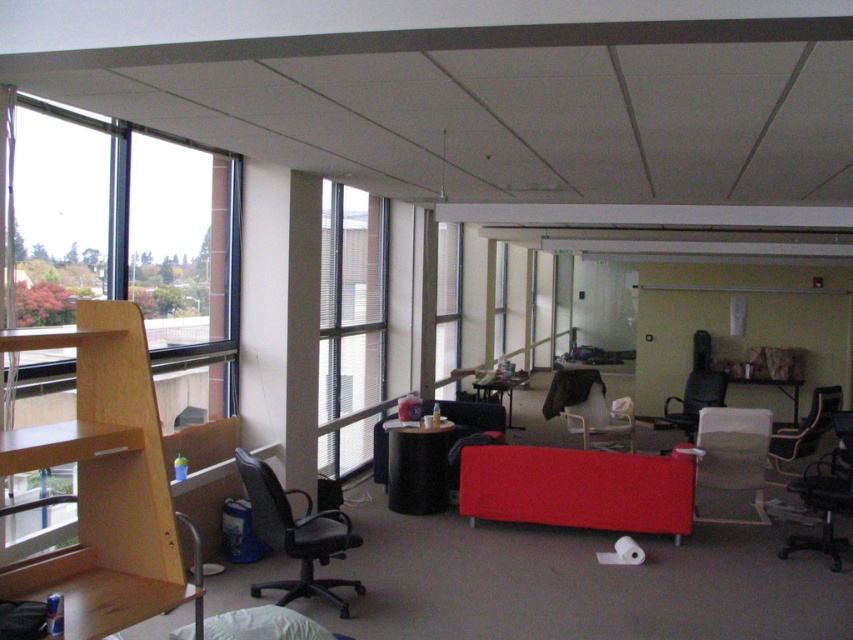
Question: Among these points, which one is farthest from the camera?

Choices:
 (A) (430, 465)
 (B) (317, 554)
 (C) (490, 397)

Answer: (C)

Question: Is gray fabric chair at center smaller than transparent glass window at center?

Choices:
 (A) no
 (B) yes

Answer: (B)

Question: Is gray fabric chair at center above black matte table at center?

Choices:
 (A) yes
 (B) no

Answer: (B)

Question: Can you confirm if black mesh office chair at right is positioned to the left of matte black armchair at center?

Choices:
 (A) yes
 (B) no

Answer: (B)

Question: Estimate the real-world distances between objects in this image. Which object is closer to the white fabric armchair at center?

Choices:
 (A) black mesh office chair at right
 (B) black matte table at center

Answer: (A)

Question: Which object is the farthest from the matte black armchair at center?

Choices:
 (A) metallic silver table at center
 (B) transparent glass window at center
 (C) white fabric armchair at center

Answer: (B)